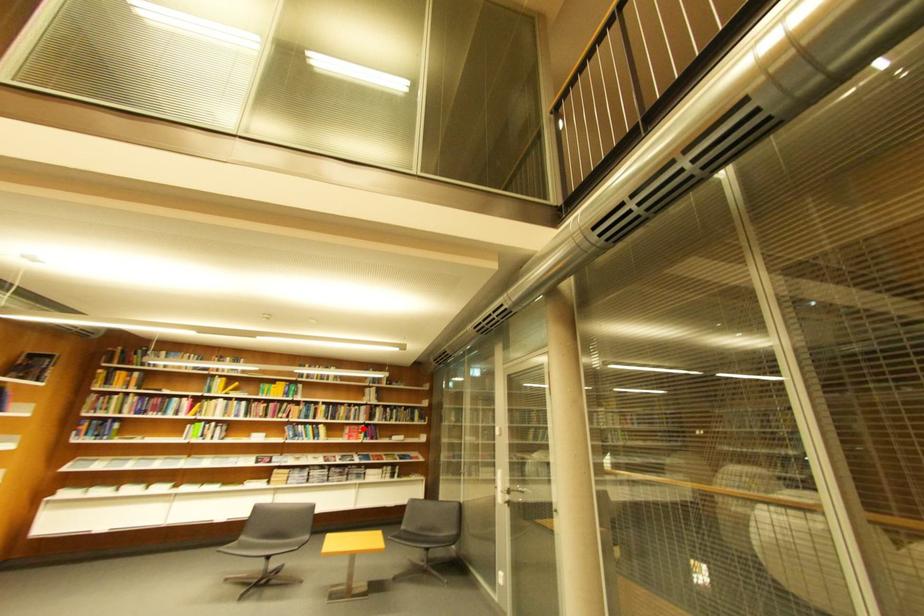
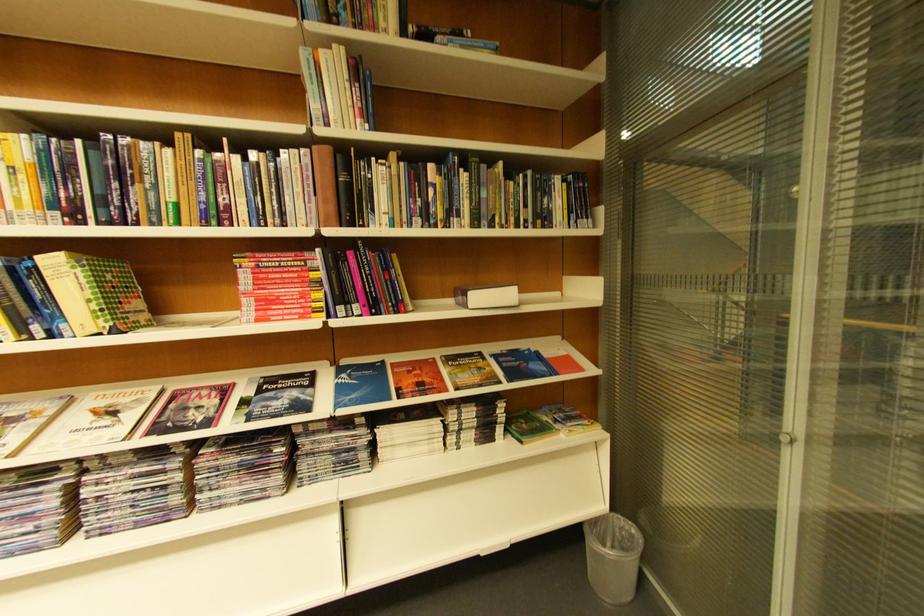
Where in the second image is the point corresponding to the highlighted location from the first image?

(281, 262)